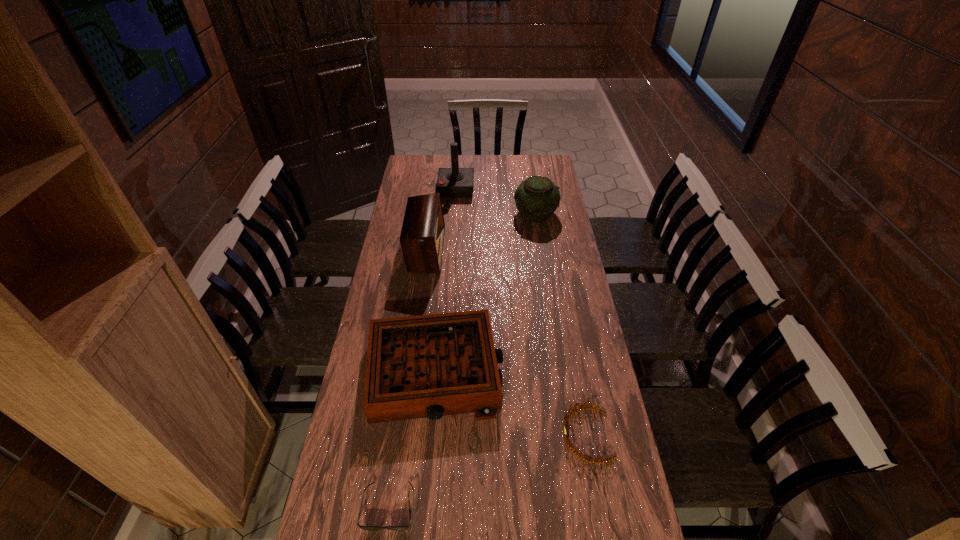
Identify the location of joystick. Image resolution: width=960 pixels, height=540 pixels. (452, 182).

This screenshot has height=540, width=960. I want to click on the farthest object, so click(452, 182).

The height and width of the screenshot is (540, 960). In order to click on radio receiver in this screenshot , I will do `click(422, 235)`.

At what (x,y) coordinates should I click in order to perform the action: click on pottery. Please return your answer as a coordinate pair (x, y). Looking at the image, I should click on (537, 197).

The height and width of the screenshot is (540, 960). I want to click on gameboard, so click(x=428, y=366).

Find the location of a particular element. This screenshot has width=960, height=540. the fifth tallest object is located at coordinates (568, 415).

The height and width of the screenshot is (540, 960). I want to click on sunglasses, so click(x=406, y=527).

Identify the location of the nearest object. (406, 527).

Where is `free region located 0.180m on the rectangular base of the farthest object`? This screenshot has width=960, height=540. free region located 0.180m on the rectangular base of the farthest object is located at coordinates (510, 188).

Locate an element on the screen. The image size is (960, 540). vacant area situated 0.300m on the front-facing side of the radio receiver is located at coordinates (515, 250).